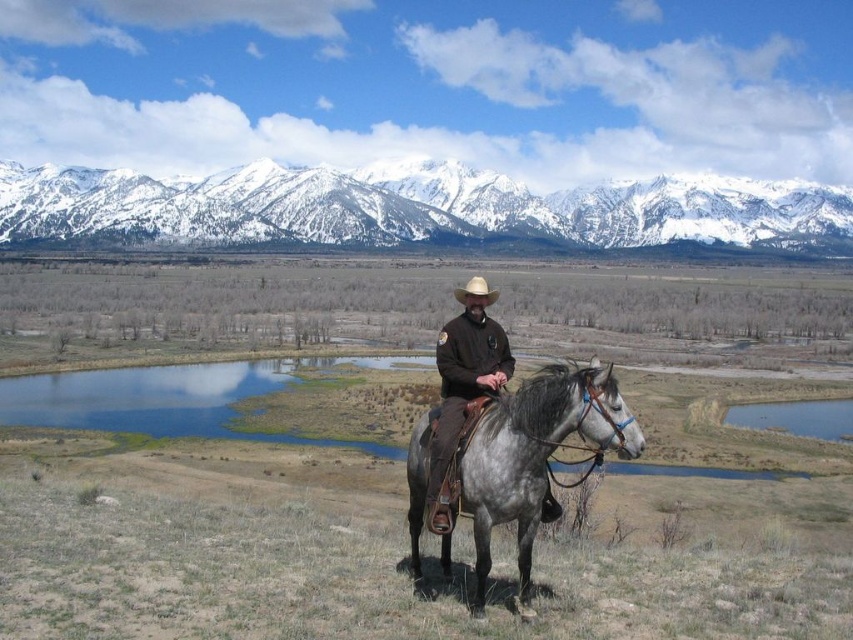
Question: Does snowy granite mountains at upper center lie in front of brown felt cowboy hat at center?

Choices:
 (A) no
 (B) yes

Answer: (A)

Question: Does gray leather horse at center have a lesser width compared to brown felt cowboy hat at center?

Choices:
 (A) no
 (B) yes

Answer: (A)

Question: Which of the following is the closest to the observer?

Choices:
 (A) gray leather horse at center
 (B) brown leather jacket at center

Answer: (A)

Question: Is brown leather jacket at center further to the viewer compared to brown felt cowboy hat at center?

Choices:
 (A) no
 (B) yes

Answer: (A)

Question: Which object appears closest to the camera in this image?

Choices:
 (A) brown leather jacket at center
 (B) gray leather horse at center

Answer: (B)

Question: Which point is farther to the camera?

Choices:
 (A) (448, 376)
 (B) (473, 275)
 (C) (0, 177)

Answer: (C)